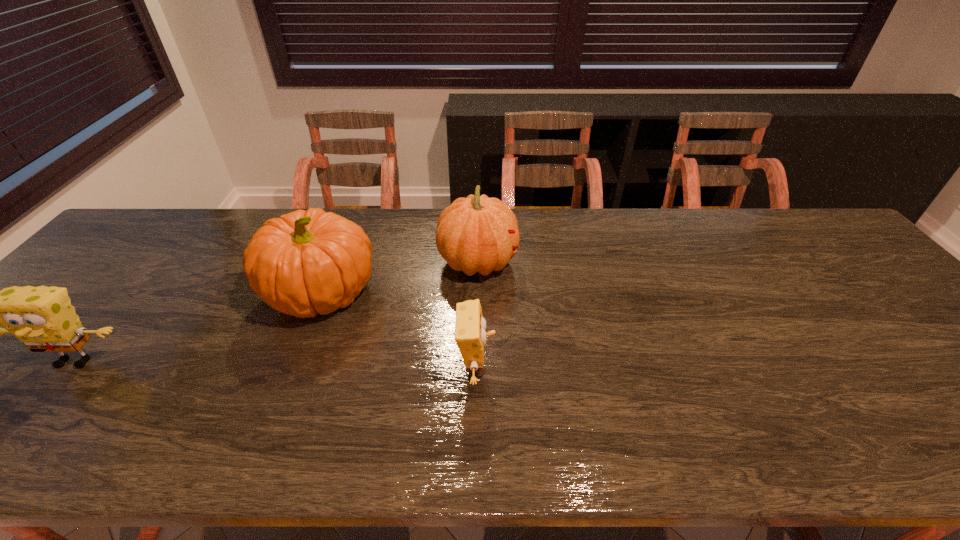
This screenshot has height=540, width=960. I want to click on vacant space that satisfies the following two spatial constraints: 1. on the surface of the left pumpkin; 2. on the face of the taller sponge, so click(298, 361).

The width and height of the screenshot is (960, 540). In order to click on free spot that satisfies the following two spatial constraints: 1. on the surface of the third object from right to left; 2. on the face of the third tallest object in this screenshot , I will do `click(298, 361)`.